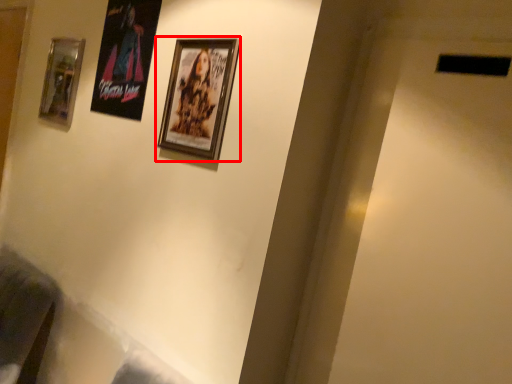
Question: From the image's perspective, where is picture frame (annotated by the red box) located relative to picture frame?

Choices:
 (A) above
 (B) below

Answer: (B)